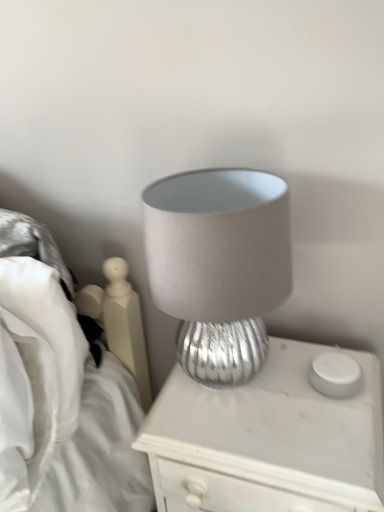
Identify the location of vacant space situated above silver textured lamp at center (from a real-world perspective). (272, 401).